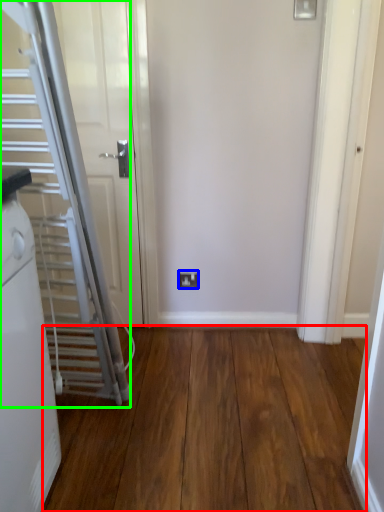
Question: Which object is positioned farthest from corridor (highlighted by a red box)? Select from electric outlet (highlighted by a blue box) and escalator (highlighted by a green box).

Choices:
 (A) electric outlet
 (B) escalator

Answer: (A)